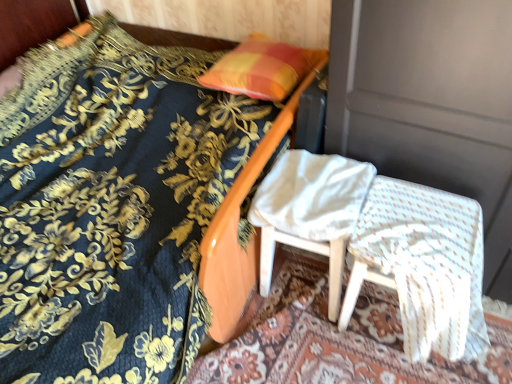
Locate an element on the screen. vacant point above white woven fabric chair at lower right, which is the second chair from left to right (from a real-world perspective) is located at coordinates (413, 234).